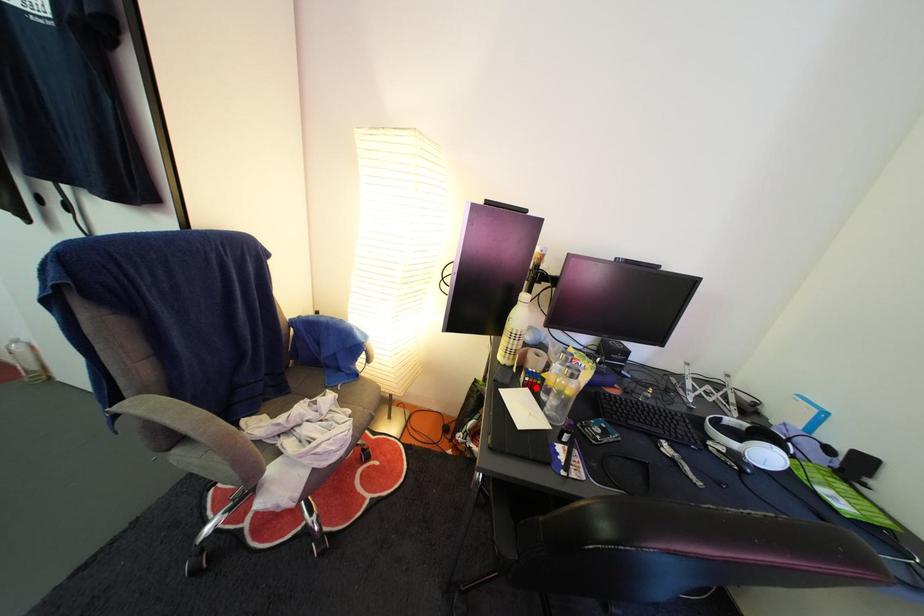
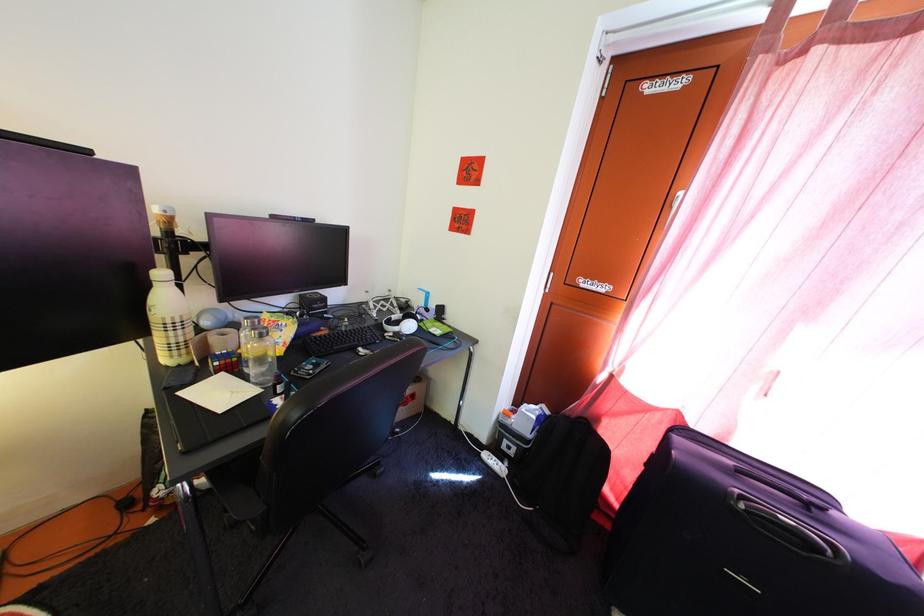
Question: I am providing you with two images of the same scene from different viewpoints. A red point is marked on the first image. Is the red point's position out of view in image 2?

Choices:
 (A) Yes
 (B) No

Answer: (B)